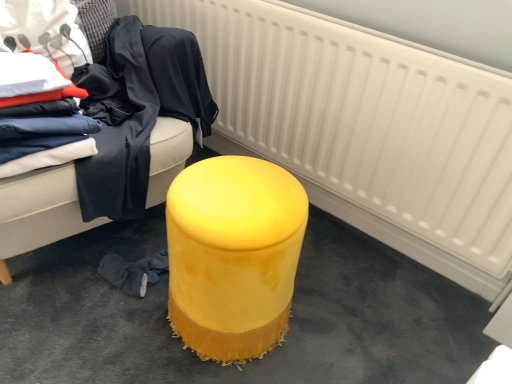
Describe the element at coordinates (44, 31) in the screenshot. I see `matte white fabric at upper left, the first clothing positioned from the left` at that location.

Measure the distance between point (x=455, y=215) and camera.

3.86 feet.

Looking at this image, measure the distance between point (221, 305) and camera.

Point (221, 305) is 37.68 inches away from camera.

Locate an element on the screen. Image resolution: width=512 pixels, height=384 pixels. dark blue fabric at left, which is the 3th clothing in left-to-right order is located at coordinates (118, 126).

Where is `matte white fabric at upper left, the first clothing positioned from the left`? This screenshot has width=512, height=384. matte white fabric at upper left, the first clothing positioned from the left is located at coordinates (44, 31).

Is velvet yellow ottoman at center inside or outside of matte white fabric at upper left, placed as the fourth clothing when sorted from right to left?

velvet yellow ottoman at center is located beyond the bounds of matte white fabric at upper left, placed as the fourth clothing when sorted from right to left.

In the scene shown: Is velvet yellow ottoman at center positioned with its back to matte white fabric at upper left, placed as the fourth clothing when sorted from right to left?

Yes.

From a real-world perspective, is velvet yellow ottoman at center above or below matte white fabric at upper left, the first clothing positioned from the left?

velvet yellow ottoman at center is below matte white fabric at upper left, the first clothing positioned from the left.

Is the depth of velvet yellow ottoman at center less than that of matte white fabric at upper left, the first clothing positioned from the left?

Yes, it is.

Would you say matte white fabric at upper left, placed as the fourth clothing when sorted from right to left, is inside or outside dark blue fabric at left, which is the 3th clothing in left-to-right order?

matte white fabric at upper left, placed as the fourth clothing when sorted from right to left, is spatially situated outside dark blue fabric at left, which is the 3th clothing in left-to-right order.

Is matte white fabric at upper left, the first clothing positioned from the left, placed right next to dark blue fabric at left, which ranks as the 2th clothing in right-to-left order?

No, matte white fabric at upper left, the first clothing positioned from the left, is not beside dark blue fabric at left, which ranks as the 2th clothing in right-to-left order.

Is matte white fabric at upper left, placed as the fourth clothing when sorted from right to left, shorter than dark blue fabric at left, which is the 3th clothing in left-to-right order?

Yes, matte white fabric at upper left, placed as the fourth clothing when sorted from right to left, is shorter than dark blue fabric at left, which is the 3th clothing in left-to-right order.

Which is more to the right, matte white fabric at upper left, the first clothing positioned from the left, or dark blue fabric at left, which is the 3th clothing in left-to-right order?

dark blue fabric at left, which is the 3th clothing in left-to-right order, is more to the right.

Considering the sizes of objects velvet yellow stool at center and white textured radiator at center in the image provided, who is wider, velvet yellow stool at center or white textured radiator at center?

velvet yellow stool at center is wider.

From the picture: Does velvet yellow stool at center turn towards white textured radiator at center?

No, velvet yellow stool at center is not turned towards white textured radiator at center.

Is velvet yellow stool at center far from white textured radiator at center?

No, velvet yellow stool at center is in close proximity to white textured radiator at center.

In the image, is velvet yellow stool at center on the left side or the right side of white textured radiator at center?

From the image, it's evident that velvet yellow stool at center is to the left of white textured radiator at center.

Looking at this image, is matte white fabric at upper left, the first clothing positioned from the left, oriented away from white textured radiator at center?

No, matte white fabric at upper left, the first clothing positioned from the left,'s orientation is not away from white textured radiator at center.

Is matte white fabric at upper left, placed as the fourth clothing when sorted from right to left, taller or shorter than white textured radiator at center?

Considering their sizes, matte white fabric at upper left, placed as the fourth clothing when sorted from right to left, has less height than white textured radiator at center.

Does point (20, 45) come closer to viewer compared to point (342, 192)?

Yes, it is in front of point (342, 192).

Which is more to the right, white textured radiator at center or dark blue fabric at left, which ranks as the 2th clothing in right-to-left order?

white textured radiator at center.

Is white textured radiator at center touching dark blue fabric at left, which is the 3th clothing in left-to-right order?

No, white textured radiator at center is not beside dark blue fabric at left, which is the 3th clothing in left-to-right order.

Which is correct: white textured radiator at center is inside dark blue fabric at left, which is the 3th clothing in left-to-right order, or outside of it?

white textured radiator at center is spatially situated outside dark blue fabric at left, which is the 3th clothing in left-to-right order.

From the picture: How different are the orientations of white textured radiator at center and dark blue fabric at left, which is the 3th clothing in left-to-right order, in degrees?

white textured radiator at center and dark blue fabric at left, which is the 3th clothing in left-to-right order, are facing 50.8 degrees away from each other.

Considering the relative sizes of white textured radiator at center and velvet fabric clothes at left, placed as the 3th clothing when sorted from right to left, in the image provided, is white textured radiator at center bigger than velvet fabric clothes at left, placed as the 3th clothing when sorted from right to left,?

Indeed, white textured radiator at center has a larger size compared to velvet fabric clothes at left, placed as the 3th clothing when sorted from right to left.

Image resolution: width=512 pixels, height=384 pixels. What are the coordinates of `clothing that is the 3rd object above the white textured radiator at center (from a real-world perspective)` in the screenshot? It's located at (40, 116).

From the image's perspective, between white textured radiator at center and velvet fabric clothes at left, the second clothing when ordered from left to right, which one is located above?

white textured radiator at center appears higher in the image.

Measure the distance between white textured radiator at center and velvet fabric clothes at left, placed as the 3th clothing when sorted from right to left.

27.89 inches.

Which object is wider, dark blue fabric at left, which ranks as the 4th clothing in left-to-right order, or dark blue fabric at left, which is the 3th clothing in left-to-right order?

dark blue fabric at left, which is the 3th clothing in left-to-right order.

From a real-world perspective, who is located higher, dark blue fabric at left, which ranks as the 4th clothing in left-to-right order, or dark blue fabric at left, which ranks as the 2th clothing in right-to-left order?

dark blue fabric at left, which ranks as the 4th clothing in left-to-right order, from a real-world perspective.

Considering the positions of objects dark blue fabric at left, which ranks as the 4th clothing in left-to-right order, and dark blue fabric at left, which is the 3th clothing in left-to-right order, in the image provided, who is more to the right, dark blue fabric at left, which ranks as the 4th clothing in left-to-right order, or dark blue fabric at left, which is the 3th clothing in left-to-right order,?

dark blue fabric at left, which ranks as the 4th clothing in left-to-right order, is more to the right.

Considering the positions of point (184, 100) and point (106, 107), is point (184, 100) closer or farther from the camera than point (106, 107)?

Point (184, 100).

Find the location of a particular element. furniture that is below the matte white fabric at upper left, the first clothing positioned from the left (from the image's perspective) is located at coordinates (39, 212).

This screenshot has width=512, height=384. What are the coordinates of `the 2nd clothing counting from the left side of the dark blue fabric at left, which is the 3th clothing in left-to-right order` in the screenshot? It's located at (44, 31).

From the image, which object appears to be nearer to white textured radiator at center, dark blue fabric at left, which ranks as the 2th clothing in right-to-left order, or dark blue fabric at left, which ranks as the 4th clothing in left-to-right order?

Based on the image, dark blue fabric at left, which ranks as the 4th clothing in left-to-right order, appears to be nearer to white textured radiator at center.

From the picture: Considering their positions, is matte white fabric at upper left, the first clothing positioned from the left, positioned closer to white textured radiator at center than dark blue fabric at left, which ranks as the 4th clothing in left-to-right order?

dark blue fabric at left, which ranks as the 4th clothing in left-to-right order, is closer to white textured radiator at center.

When comparing their distances from velvet yellow stool at center, does velvet fabric clothes at left, placed as the 3th clothing when sorted from right to left, or dark blue fabric at left, which ranks as the 2th clothing in right-to-left order, seem further?

velvet fabric clothes at left, placed as the 3th clothing when sorted from right to left, is positioned further to the anchor velvet yellow stool at center.

From the image, which object appears to be nearer to matte white fabric at upper left, placed as the fourth clothing when sorted from right to left, dark blue fabric at left, which ranks as the 4th clothing in left-to-right order, or white textured radiator at center?

dark blue fabric at left, which ranks as the 4th clothing in left-to-right order, is closer to matte white fabric at upper left, placed as the fourth clothing when sorted from right to left.

Based on the photo, from the image, which object appears to be farther from dark blue fabric at left, which ranks as the 4th clothing in left-to-right order, velvet yellow ottoman at center or velvet fabric clothes at left, placed as the 3th clothing when sorted from right to left?

velvet fabric clothes at left, placed as the 3th clothing when sorted from right to left, is further to dark blue fabric at left, which ranks as the 4th clothing in left-to-right order.

From the image, which object appears to be nearer to dark blue fabric at left, which ranks as the 2th clothing in right-to-left order, matte white fabric at upper left, the first clothing positioned from the left, or velvet yellow stool at center?

The object closer to dark blue fabric at left, which ranks as the 2th clothing in right-to-left order, is matte white fabric at upper left, the first clothing positioned from the left.

Looking at the image, which one is located further to matte white fabric at upper left, placed as the fourth clothing when sorted from right to left, dark blue fabric at left, which is the 3th clothing in left-to-right order, or white textured radiator at center?

white textured radiator at center is further to matte white fabric at upper left, placed as the fourth clothing when sorted from right to left.

Based on their spatial positions, is velvet yellow stool at center or dark blue fabric at left, which ranks as the 2th clothing in right-to-left order, closer to dark blue fabric at left, positioned as the first clothing in right-to-left order?

dark blue fabric at left, which ranks as the 2th clothing in right-to-left order, is positioned closer to the anchor dark blue fabric at left, positioned as the first clothing in right-to-left order.

You are a GUI agent. You are given a task and a screenshot of the screen. Output one action in this format:
    pyautogui.click(x=<x>, y=<y>)
    Task: Click on the clothing between dark blue fabric at left, which ranks as the 2th clothing in right-to-left order, and white textured radiator at center, in the horizontal direction
    Image resolution: width=512 pixels, height=384 pixels.
    Given the screenshot: What is the action you would take?
    pyautogui.click(x=179, y=77)

Find the location of a particular element. This screenshot has width=512, height=384. furniture between dark blue fabric at left, which ranks as the 4th clothing in left-to-right order, and velvet yellow stool at center in the up-down direction is located at coordinates (39, 212).

Locate an element on the screen. clothing positioned between velvet fabric clothes at left, the second clothing when ordered from left to right, and matte white fabric at upper left, the first clothing positioned from the left, from near to far is located at coordinates pyautogui.click(x=118, y=126).

Locate an element on the screen. The width and height of the screenshot is (512, 384). furniture between matte white fabric at upper left, the first clothing positioned from the left, and velvet yellow stool at center, in the vertical direction is located at coordinates (39, 212).